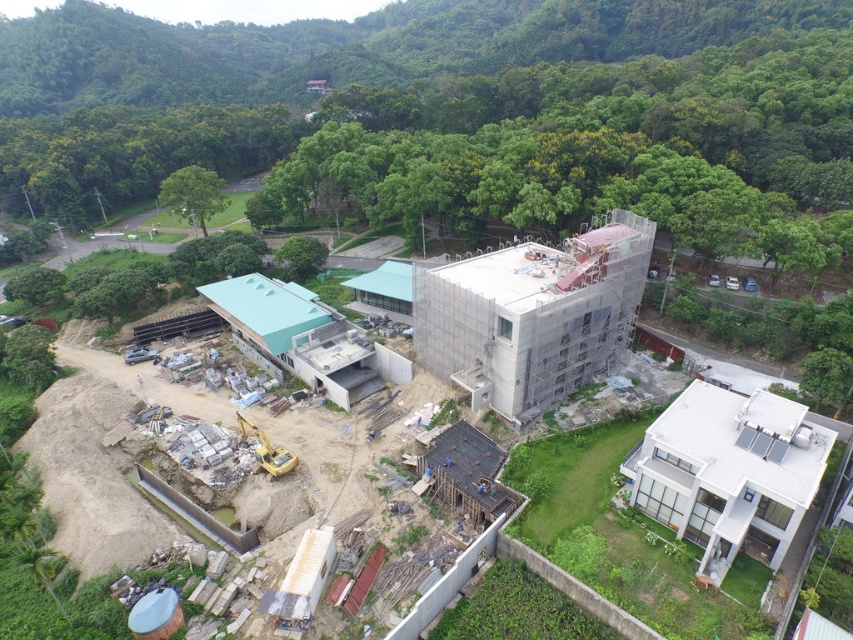
Does scaffolding concrete building at center appear on the left side of green leafy tree at center-left?

In fact, scaffolding concrete building at center is to the right of green leafy tree at center-left.

Can you confirm if scaffolding concrete building at center is thinner than green leafy tree at center-left?

No.

You are a GUI agent. You are given a task and a screenshot of the screen. Output one action in this format:
    pyautogui.click(x=<x>, y=<y>)
    Task: Click on the scaffolding concrete building at center
    
    Given the screenshot: What is the action you would take?
    pyautogui.click(x=746, y=412)

Can you confirm if sandy concrete building at center is thinner than scaffolding concrete building at center?

Correct, sandy concrete building at center's width is less than scaffolding concrete building at center's.

Between point (645, 228) and point (672, 438), which one is positioned behind?

Positioned behind is point (645, 228).

At what (x,y) coordinates should I click in order to perform the action: click on sandy concrete building at center. Please return your answer as a coordinate pair (x, y). This screenshot has height=640, width=853. Looking at the image, I should click on click(532, 316).

Between sandy concrete building at center and green leafy tree at center-left, which one appears on the right side from the viewer's perspective?

sandy concrete building at center

Based on the photo, which is below, sandy concrete building at center or green leafy tree at center-left?

Positioned lower is sandy concrete building at center.

Which is behind, point (544, 298) or point (183, 204)?

The point (183, 204) is behind.

Where is `sandy concrete building at center`? This screenshot has height=640, width=853. sandy concrete building at center is located at coordinates (532, 316).